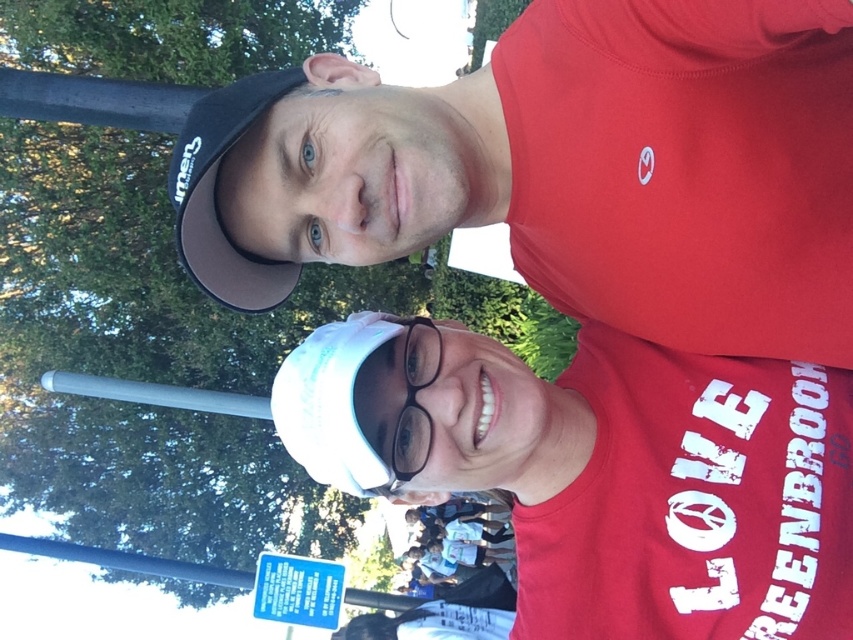
Could you measure the distance between black matte baseball cap at upper left and transparent plastic glasses at center?

black matte baseball cap at upper left and transparent plastic glasses at center are 12.11 inches apart.

Does black matte baseball cap at upper left have a larger size compared to transparent plastic glasses at center?

Yes, black matte baseball cap at upper left is bigger than transparent plastic glasses at center.

At what (x,y) coordinates should I click in order to perform the action: click on black matte baseball cap at upper left. Please return your answer as a coordinate pair (x, y). Image resolution: width=853 pixels, height=640 pixels. Looking at the image, I should click on pyautogui.click(x=213, y=195).

I want to click on black matte baseball cap at upper left, so [x=213, y=195].

Between point (712, 33) and point (413, 346), which one is positioned behind?

Positioned behind is point (413, 346).

Is point (550, 257) in front of point (426, 461)?

No, (550, 257) is further to viewer.

Between point (448, 166) and point (415, 385), which one is positioned behind?

The point (415, 385) is behind.

Where is `white matte cap at upper center`? The width and height of the screenshot is (853, 640). white matte cap at upper center is located at coordinates (685, 168).

Which is more to the right, white matte cap at upper center or black matte baseball cap at upper left?

white matte cap at upper center

Does point (200, 120) come in front of point (231, 289)?

Yes.

Identify the location of white matte cap at upper center. (685, 168).